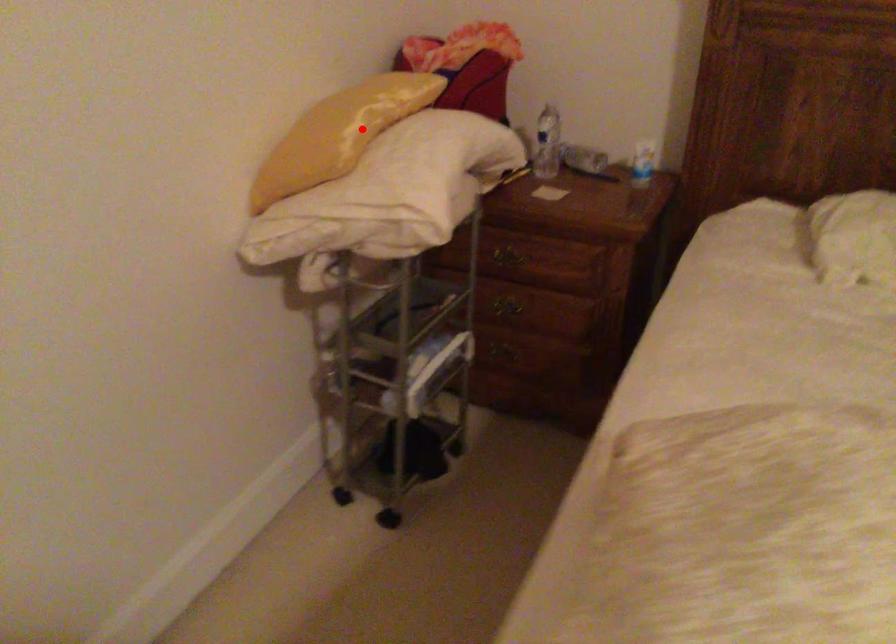
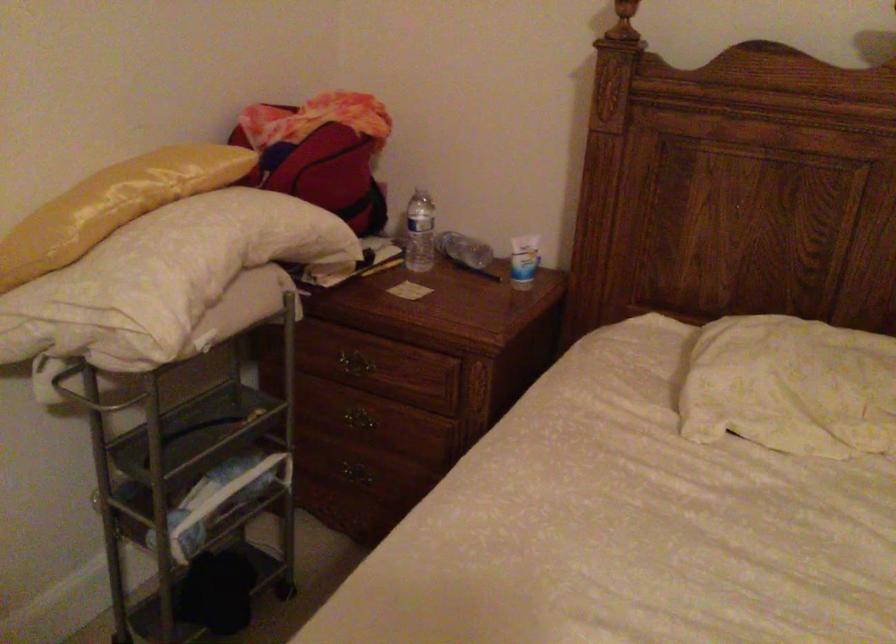
Question: I am providing you with two images of the same scene from different viewpoints. In image1, a red point is highlighted. Considering the same 3D point in image2, which of the following is correct?

Choices:
 (A) It is closer
 (B) It is farther

Answer: (A)